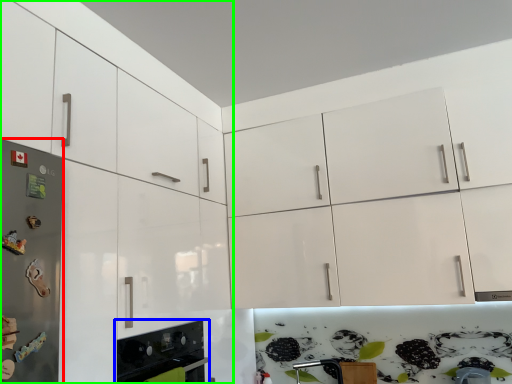
Question: Considering the real-world distances, which object is closest to fridge (highlighted by a red box)? home appliance (highlighted by a blue box) or cabinetry (highlighted by a green box).

Choices:
 (A) home appliance
 (B) cabinetry

Answer: (B)